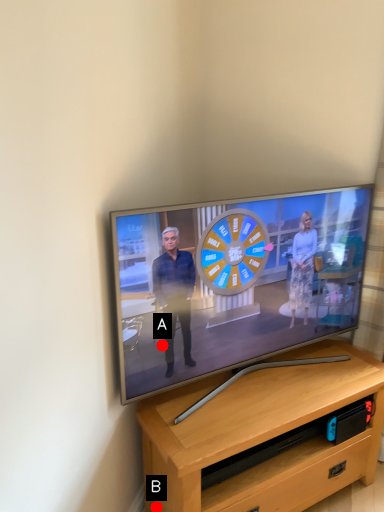
Question: Two points are circled on the image, labeled by A and B beside each circle. Which point is closer to the camera taking this photo?

Choices:
 (A) A is closer
 (B) B is closer

Answer: (A)